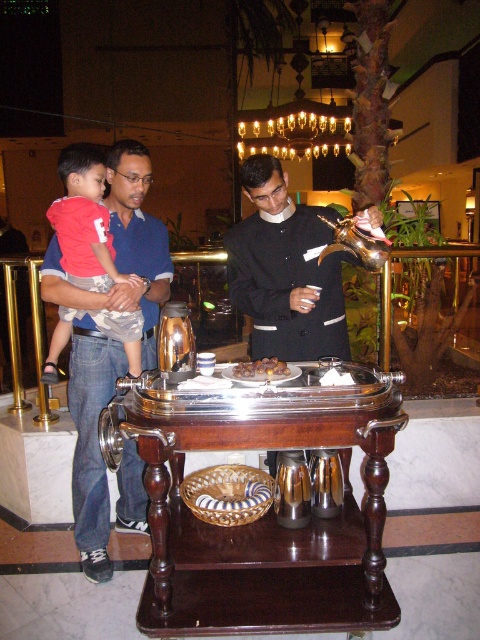
Describe the element at coordinates (123, 250) in the screenshot. The height and width of the screenshot is (640, 480). I see `blue denim jeans at left` at that location.

Locate an element on the screen. This screenshot has height=640, width=480. blue denim jeans at left is located at coordinates (123, 250).

Between shiny dark wood buffet at center and shiny black uniform at center, which one appears on the left side from the viewer's perspective?

From the viewer's perspective, shiny dark wood buffet at center appears more on the left side.

Can you confirm if shiny dark wood buffet at center is bigger than shiny black uniform at center?

Indeed, shiny dark wood buffet at center has a larger size compared to shiny black uniform at center.

Locate an element on the screen. Image resolution: width=480 pixels, height=640 pixels. shiny dark wood buffet at center is located at coordinates (266, 513).

At what (x,y) coordinates should I click in order to perform the action: click on shiny dark wood buffet at center. Please return your answer as a coordinate pair (x, y). Image resolution: width=480 pixels, height=640 pixels. Looking at the image, I should click on (266, 513).

Between shiny black uniform at center and matte red shirt at left, which one has less height?

shiny black uniform at center

What do you see at coordinates (286, 269) in the screenshot? I see `shiny black uniform at center` at bounding box center [286, 269].

This screenshot has width=480, height=640. Find the location of `shiny black uniform at center`. shiny black uniform at center is located at coordinates (286, 269).